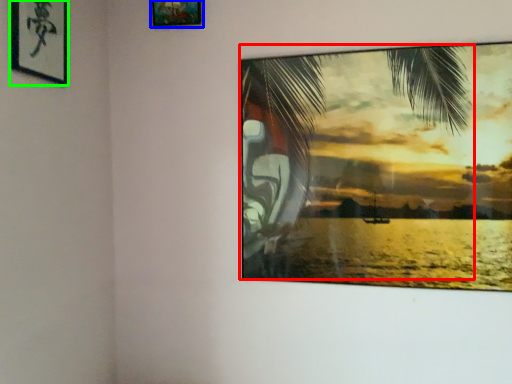
Question: Considering the real-world distances, which object is farthest from palm tree (highlighted by a red box)? picture frame (highlighted by a blue box) or picture frame (highlighted by a green box)?

Choices:
 (A) picture frame
 (B) picture frame

Answer: (B)